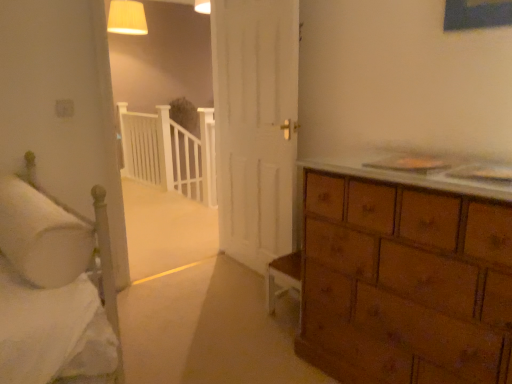
Question: Considering the relative positions of white soft pillow at left and matte cream lampshade at upper center in the image provided, is white soft pillow at left to the right of matte cream lampshade at upper center from the viewer's perspective?

Choices:
 (A) no
 (B) yes

Answer: (B)

Question: Is white soft pillow at left positioned beyond the bounds of matte cream lampshade at upper center?

Choices:
 (A) no
 (B) yes

Answer: (B)

Question: Considering the relative sizes of white soft pillow at left and matte cream lampshade at upper center in the image provided, is white soft pillow at left smaller than matte cream lampshade at upper center?

Choices:
 (A) yes
 (B) no

Answer: (A)

Question: From a real-world perspective, is white soft pillow at left located higher than matte cream lampshade at upper center?

Choices:
 (A) yes
 (B) no

Answer: (B)

Question: Does white soft pillow at left contain matte cream lampshade at upper center?

Choices:
 (A) no
 (B) yes

Answer: (A)

Question: From the image's perspective, is white soft pillow at left below matte cream lampshade at upper center?

Choices:
 (A) no
 (B) yes

Answer: (B)

Question: Can you confirm if white wooden balustrade at center is smaller than white soft pillow at left?

Choices:
 (A) yes
 (B) no

Answer: (B)

Question: Is white wooden balustrade at center to the right of white soft pillow at left from the viewer's perspective?

Choices:
 (A) yes
 (B) no

Answer: (A)

Question: Does white wooden balustrade at center touch white soft pillow at left?

Choices:
 (A) yes
 (B) no

Answer: (B)

Question: Does white wooden balustrade at center come in front of white soft pillow at left?

Choices:
 (A) yes
 (B) no

Answer: (B)

Question: Is white wooden balustrade at center behind white soft pillow at left?

Choices:
 (A) no
 (B) yes

Answer: (B)

Question: Is white wooden balustrade at center oriented away from white soft pillow at left?

Choices:
 (A) no
 (B) yes

Answer: (A)

Question: Considering the relative sizes of white wooden balustrade at center and matte cream lampshade at upper center in the image provided, is white wooden balustrade at center taller than matte cream lampshade at upper center?

Choices:
 (A) no
 (B) yes

Answer: (B)